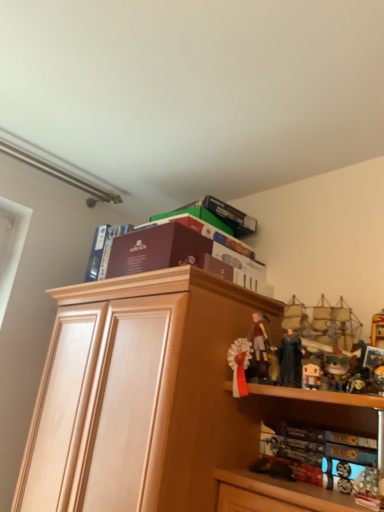
Question: From a real-world perspective, relative to maroon cardboard box at upper center, marked as the third book in a top-to-bottom arrangement, is hardcover book at lower right, positioned as the 1th book in bottom-to-top order, vertically above or below?

Choices:
 (A) above
 (B) below

Answer: (B)

Question: Considering their positions, is hardcover book at lower right, the fourth book positioned from the top, located in front of or behind maroon cardboard box at upper center, the 2th book positioned from the bottom?

Choices:
 (A) behind
 (B) front

Answer: (B)

Question: Which object is positioned closest to the light wood cabinet at center?

Choices:
 (A) maroon cardboard box at upper center, marked as the third book in a top-to-bottom arrangement
 (B) maroon cardboard book at upper center, which appears as the third book when ordered from the bottom
 (C) hardcover book at lower right, the fourth book positioned from the top
 (D) matte black figurine at upper right
 (E) matte brown box at upper center, the fourth book in the bottom-to-top sequence

Answer: (E)

Question: Estimate the real-world distances between objects in this image. Which object is closer to the light wood cabinet at center?

Choices:
 (A) matte brown figurine at center
 (B) maroon cardboard book at upper center, which is counted as the 2th book, starting from the top
 (C) matte brown box at upper center, which ranks as the 1th book in top-to-bottom order
 (D) matte black figurine at upper right
 (E) maroon cardboard box at upper center, marked as the third book in a top-to-bottom arrangement

Answer: (C)